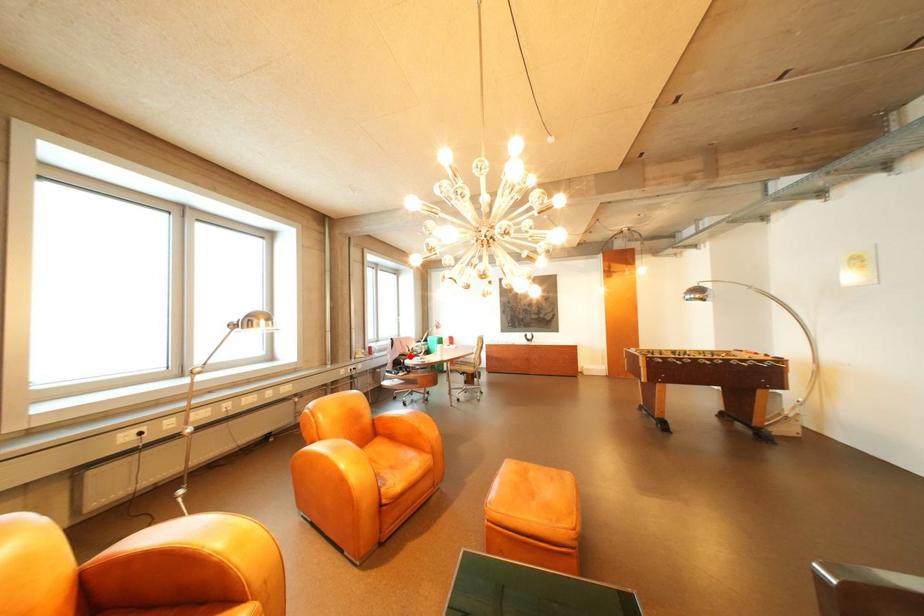
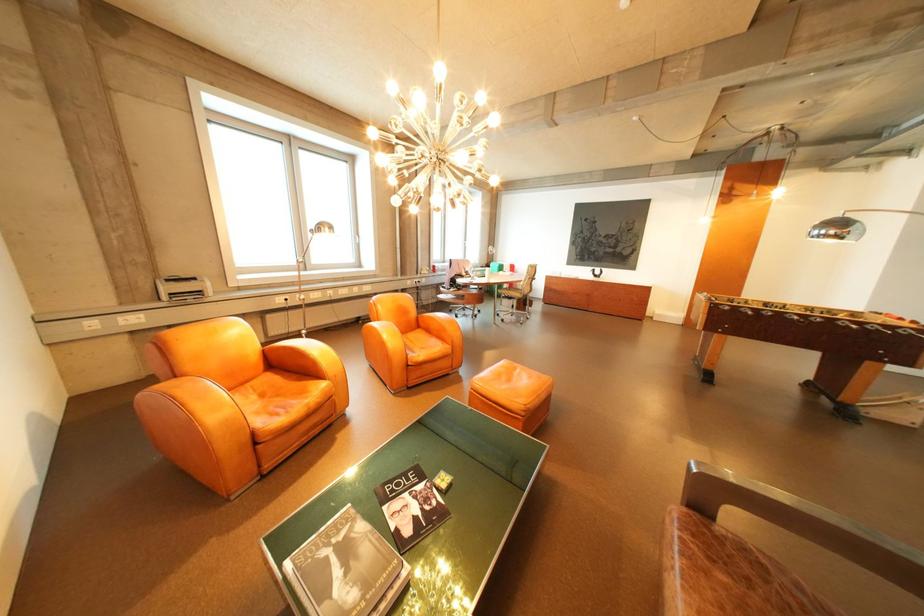
Where in the second image is the point corresponding to the highlighted location from the first image?

(467, 276)